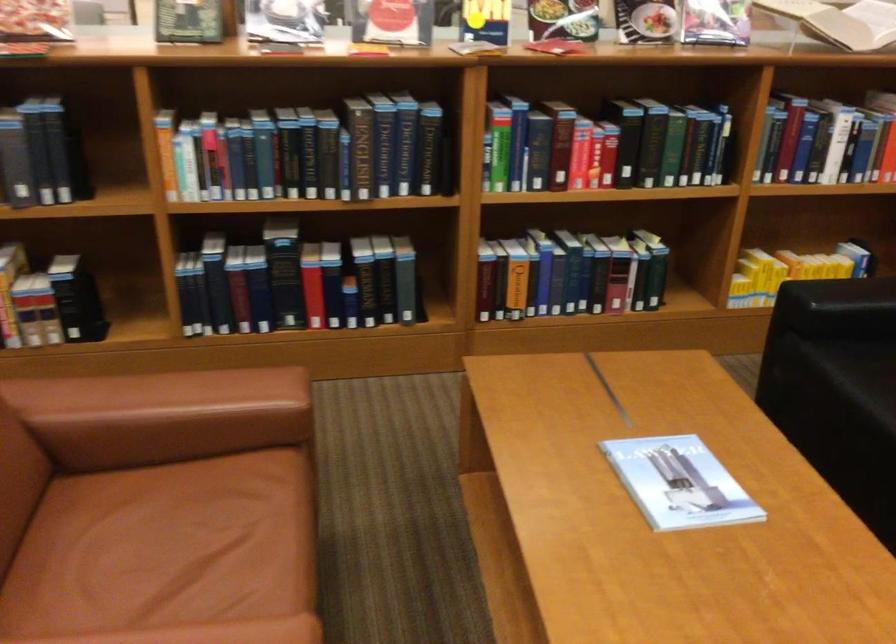
The width and height of the screenshot is (896, 644). What do you see at coordinates (169, 554) in the screenshot? I see `a sofa sitting surface` at bounding box center [169, 554].